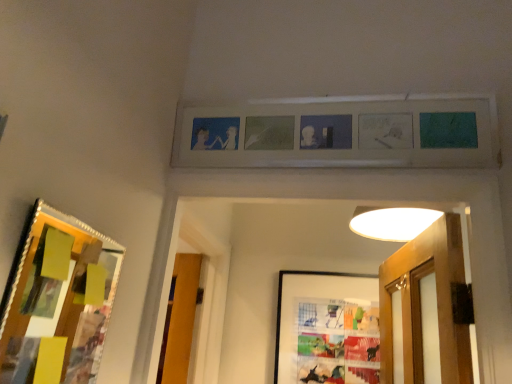
Question: From the image's perspective, would you say wooden-framed collage at left, which is the second picture frame in bottom-to-top order, is positioned over matte wooden picture frame at upper center, which is counted as the third picture frame, starting from the bottom?

Choices:
 (A) yes
 (B) no

Answer: (B)

Question: Does wooden-framed collage at left, which is the 2th picture frame from top to bottom, turn towards matte wooden picture frame at upper center, which is counted as the third picture frame, starting from the bottom?

Choices:
 (A) yes
 (B) no

Answer: (B)

Question: From the image's perspective, is wooden-framed collage at left, the first picture frame when ordered from front to back, located beneath matte wooden picture frame at upper center, the second picture frame when ordered from front to back?

Choices:
 (A) yes
 (B) no

Answer: (A)

Question: Would you say wooden-framed collage at left, the first picture frame when ordered from front to back, is outside matte wooden picture frame at upper center, which is counted as the third picture frame, starting from the bottom?

Choices:
 (A) no
 (B) yes

Answer: (B)

Question: Is wooden-framed collage at left, the 3th picture frame when ordered from back to front, in contact with matte wooden picture frame at upper center, which ranks as the 2th picture frame in back-to-front order?

Choices:
 (A) yes
 (B) no

Answer: (B)

Question: Considering the relative positions of wooden-framed collage at left, the first picture frame when ordered from front to back, and matte wooden picture frame at upper center, which ranks as the 2th picture frame in back-to-front order, in the image provided, is wooden-framed collage at left, the first picture frame when ordered from front to back, to the right of matte wooden picture frame at upper center, which ranks as the 2th picture frame in back-to-front order, from the viewer's perspective?

Choices:
 (A) yes
 (B) no

Answer: (B)

Question: Considering the relative sizes of wooden-framed collage at left, the 3th picture frame when ordered from back to front, and matte plastic picture frame at center, the 1th picture frame when ordered from back to front, in the image provided, is wooden-framed collage at left, the 3th picture frame when ordered from back to front, bigger than matte plastic picture frame at center, the 1th picture frame when ordered from back to front,?

Choices:
 (A) no
 (B) yes

Answer: (A)

Question: Is wooden-framed collage at left, which is the 2th picture frame from top to bottom, smaller than matte plastic picture frame at center, the 3th picture frame positioned from the top?

Choices:
 (A) no
 (B) yes

Answer: (B)

Question: Is wooden-framed collage at left, the 3th picture frame when ordered from back to front, aimed at matte plastic picture frame at center, which is the third picture frame from front to back?

Choices:
 (A) no
 (B) yes

Answer: (A)

Question: Is wooden-framed collage at left, the 3th picture frame when ordered from back to front, shorter than matte plastic picture frame at center, the 3th picture frame positioned from the top?

Choices:
 (A) yes
 (B) no

Answer: (A)

Question: Is wooden-framed collage at left, the first picture frame when ordered from front to back, oriented away from matte plastic picture frame at center, the 3th picture frame positioned from the top?

Choices:
 (A) yes
 (B) no

Answer: (B)

Question: Is wooden-framed collage at left, the first picture frame when ordered from front to back, positioned beyond the bounds of matte plastic picture frame at center, which ranks as the 1th picture frame in bottom-to-top order?

Choices:
 (A) yes
 (B) no

Answer: (A)

Question: Does matte plastic picture frame at center, the 3th picture frame positioned from the top, have a greater width compared to matte wooden picture frame at upper center, which ranks as the 2th picture frame in back-to-front order?

Choices:
 (A) yes
 (B) no

Answer: (B)